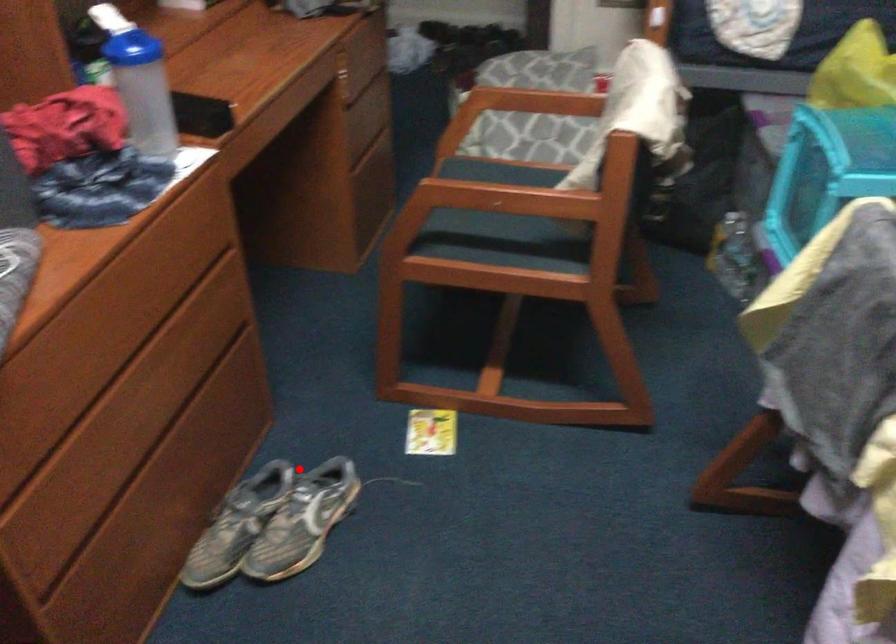
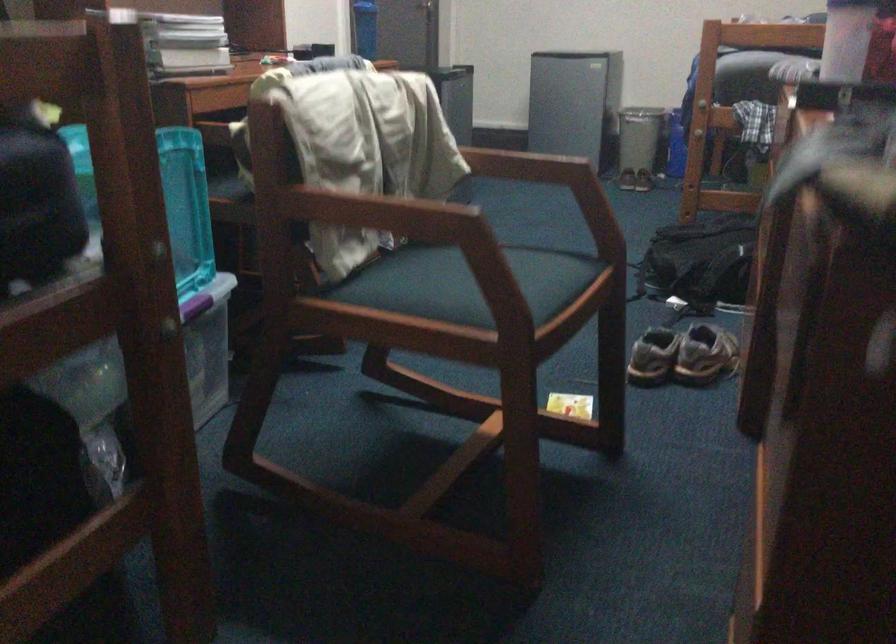
Where in the second image is the point corresponding to the highlighted location from the first image?

(682, 355)